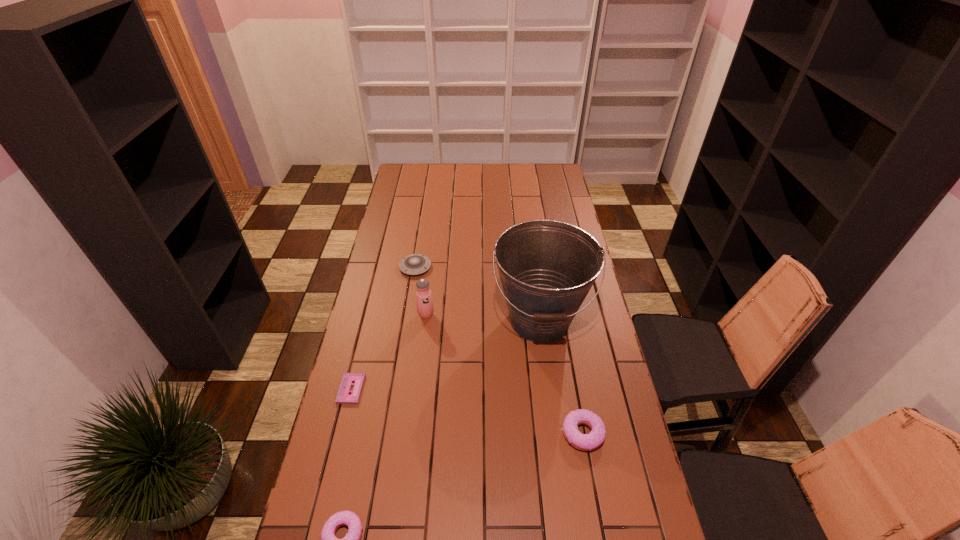
At what (x,y) coordinates should I click in order to perform the action: click on the second nearest object. Please return your answer as a coordinate pair (x, y). This screenshot has width=960, height=540. Looking at the image, I should click on (586, 442).

The width and height of the screenshot is (960, 540). I want to click on the fourth shortest object, so pyautogui.click(x=586, y=442).

This screenshot has width=960, height=540. In order to click on bucket in this screenshot , I will do point(546,267).

Image resolution: width=960 pixels, height=540 pixels. I want to click on the fourth farthest object, so click(x=343, y=396).

You are a GUI agent. You are given a task and a screenshot of the screen. Output one action in this format:
    pyautogui.click(x=<x>, y=<y>)
    Task: Click on the shortest object
    The image size is (960, 540).
    Given the screenshot: What is the action you would take?
    pyautogui.click(x=343, y=396)

The width and height of the screenshot is (960, 540). I want to click on thermos bottle, so click(x=424, y=301).

You are a GUI agent. You are given a task and a screenshot of the screen. Output one action in this format:
    pyautogui.click(x=<x>, y=<y>)
    Task: Click on the farthest object
    The image size is (960, 540).
    Given the screenshot: What is the action you would take?
    pyautogui.click(x=414, y=264)

Where is `vacant space located on the left of the fourth shortest object`? This screenshot has height=540, width=960. vacant space located on the left of the fourth shortest object is located at coordinates (469, 433).

Find the location of a particular element. vacant space positioned with the handle on opposite sides of the bucket is located at coordinates (560, 469).

I want to click on free space located 0.370m on the front of the shortest object, so click(316, 534).